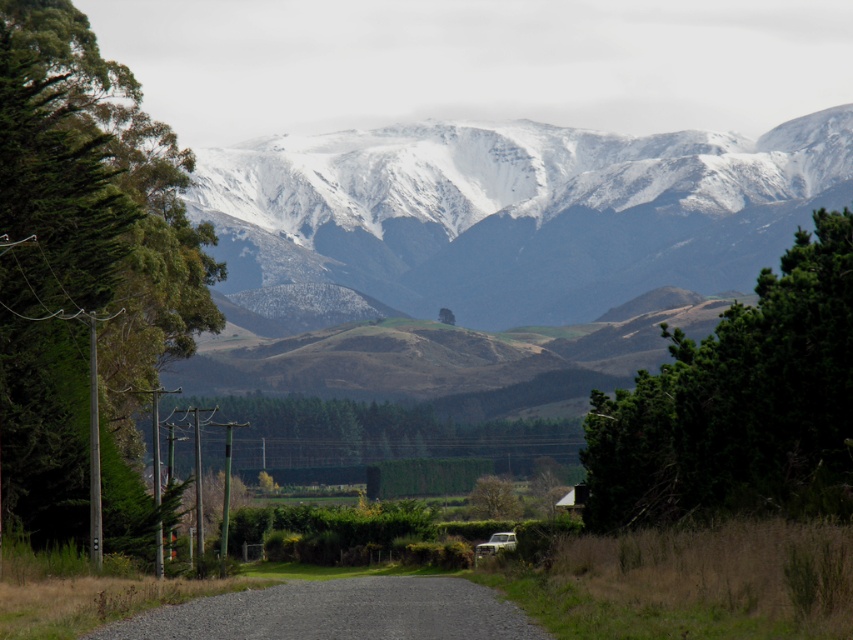
Question: Which point is closer to the camera?

Choices:
 (A) (728, 326)
 (B) (115, 513)
 (C) (807, 115)

Answer: (A)

Question: In this image, where is green textured forest at center located relative to green leafy tree at center?

Choices:
 (A) below
 (B) above

Answer: (B)

Question: Is green textured tree at right closer to camera compared to green textured forest at center?

Choices:
 (A) yes
 (B) no

Answer: (A)

Question: Among these points, which one is farthest from the camera?

Choices:
 (A) (364, 445)
 (B) (494, 477)
 (C) (851, 312)
 (D) (67, 250)

Answer: (A)

Question: Where is snowy rock mountain range at upper center located in relation to green leafy tree at left in the image?

Choices:
 (A) below
 (B) above

Answer: (B)

Question: Among these points, which one is nearest to the camera?

Choices:
 (A) (824, 403)
 (B) (496, 424)
 (C) (21, 100)
 (D) (483, 513)

Answer: (A)